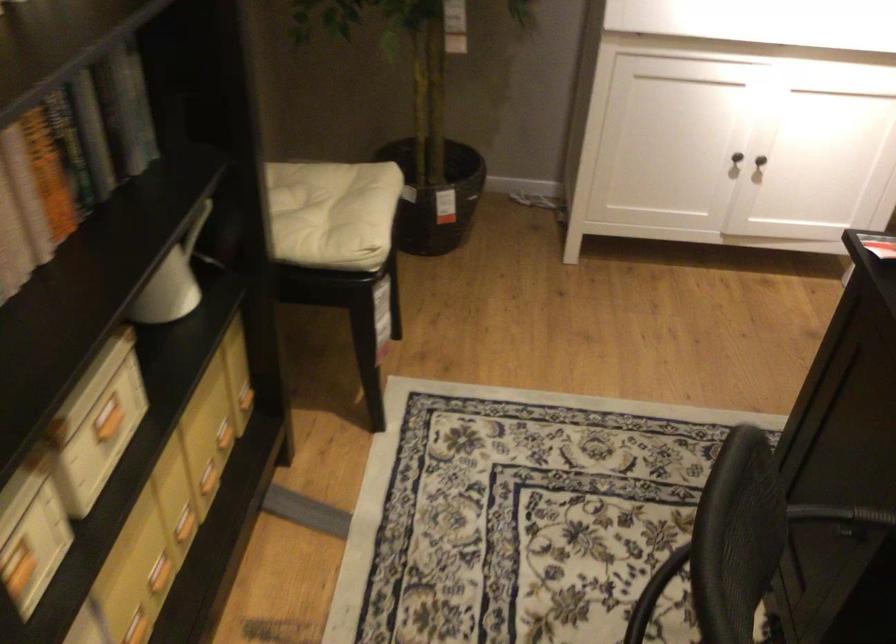
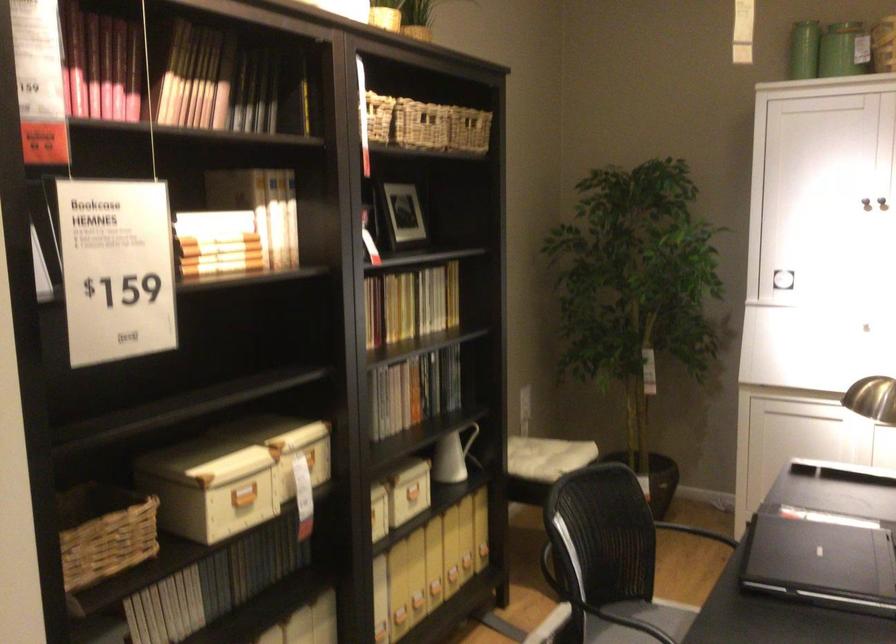
Where in the second image is the point corresponding to point 504,252 from the first image?

(695, 532)